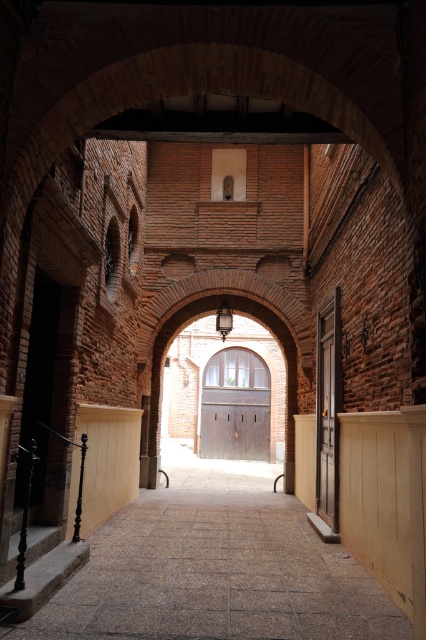
You are standing at the entrance of the arched passageway and want to open the wooden door at center. Based on its position, which direction should you move to reach the door?

The wooden door at center is located at point coordinates, so you should move forward along the passageway towards the center to reach it.